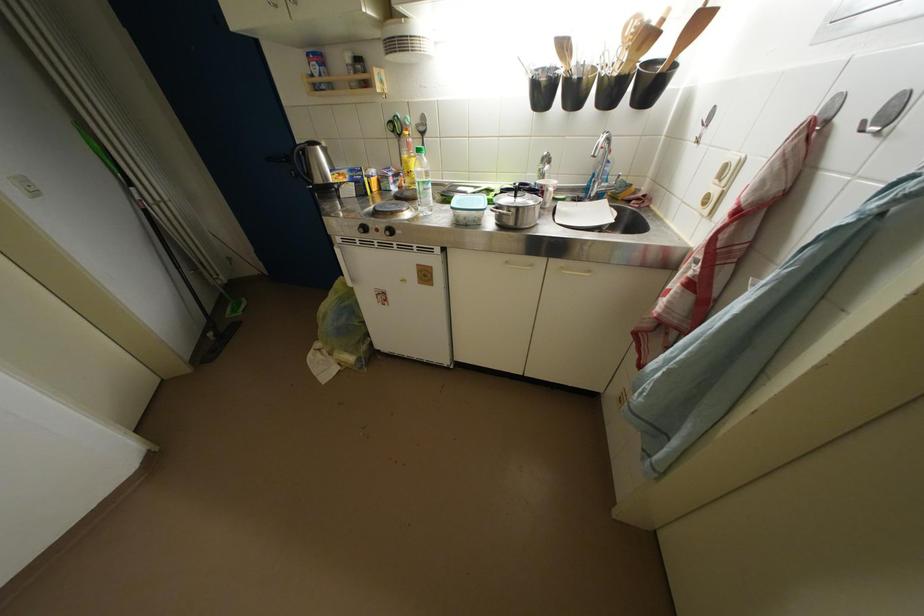
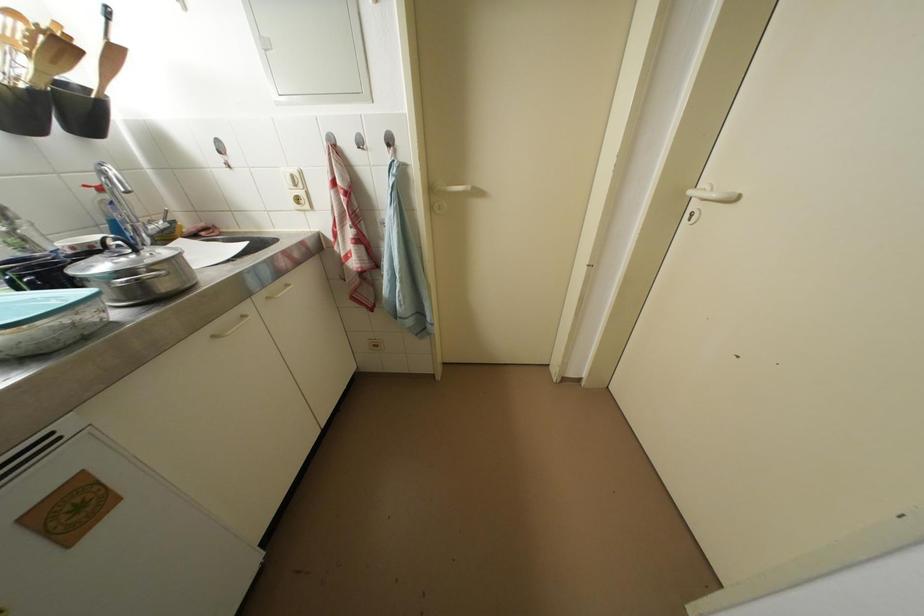
The first image is from the beginning of the video and the second image is from the end. How did the camera likely rotate when shooting the video?

The camera's rotation is toward right-down.